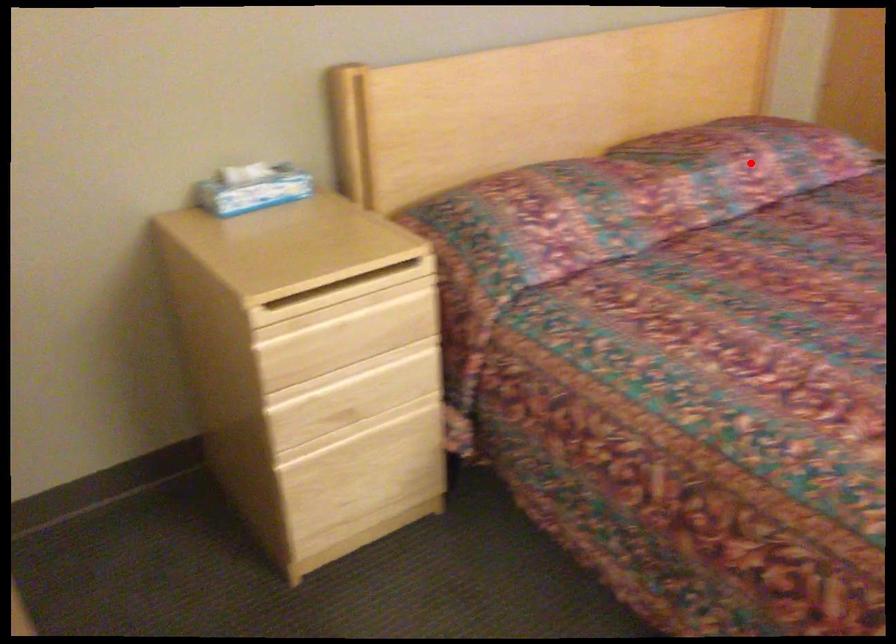
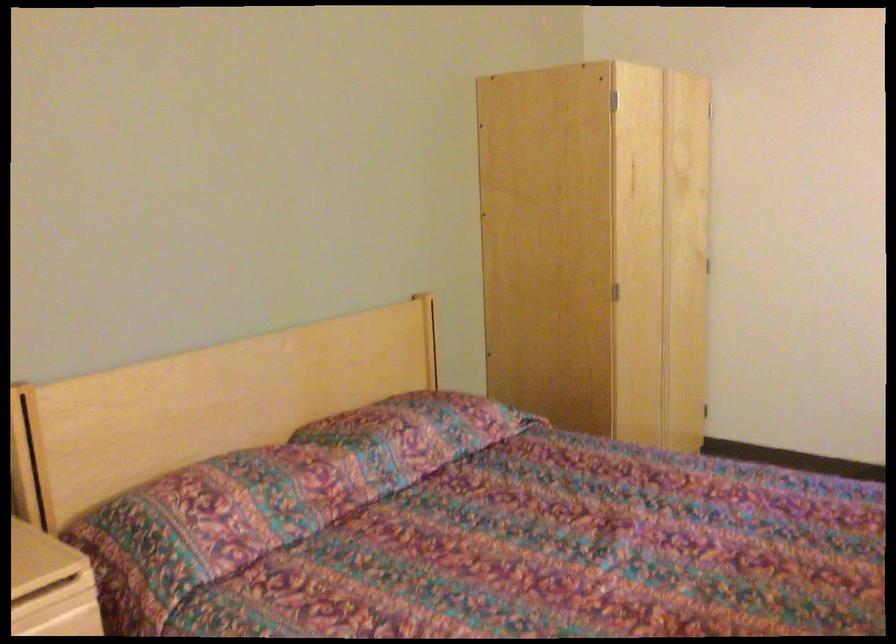
Where in the second image is the point corresponding to the highlighted location from the first image?

(414, 433)